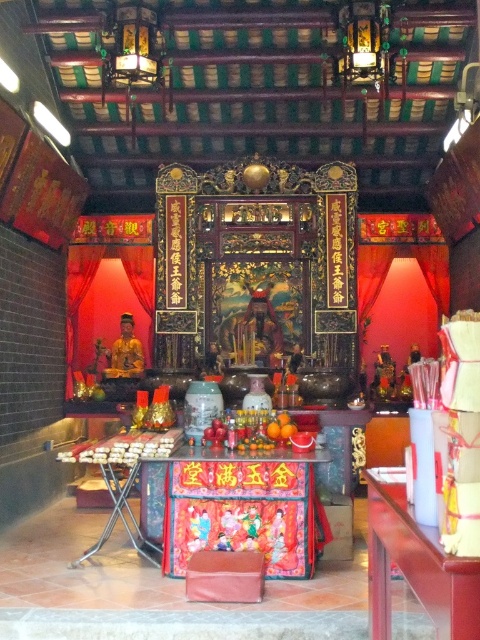
You are standing at the entrance of the temple and want to locate the colorful fabric altar at center. According to the coordinates provided, in which direction should you look to find it?

The colorful fabric altar at center is located at coordinates point [235,508], which means it is positioned to the right and slightly forward from the entrance. You should look towards the right side of the temple to find it.